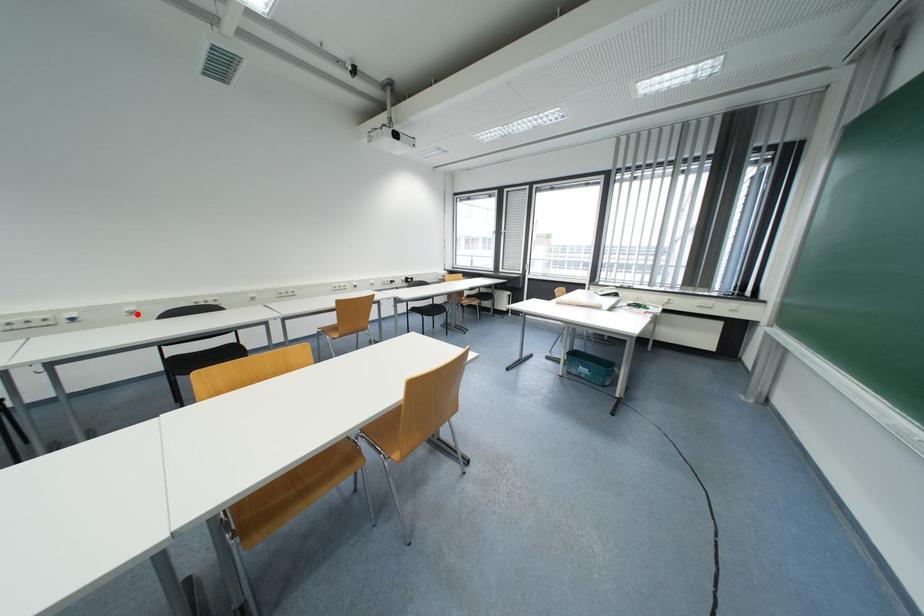
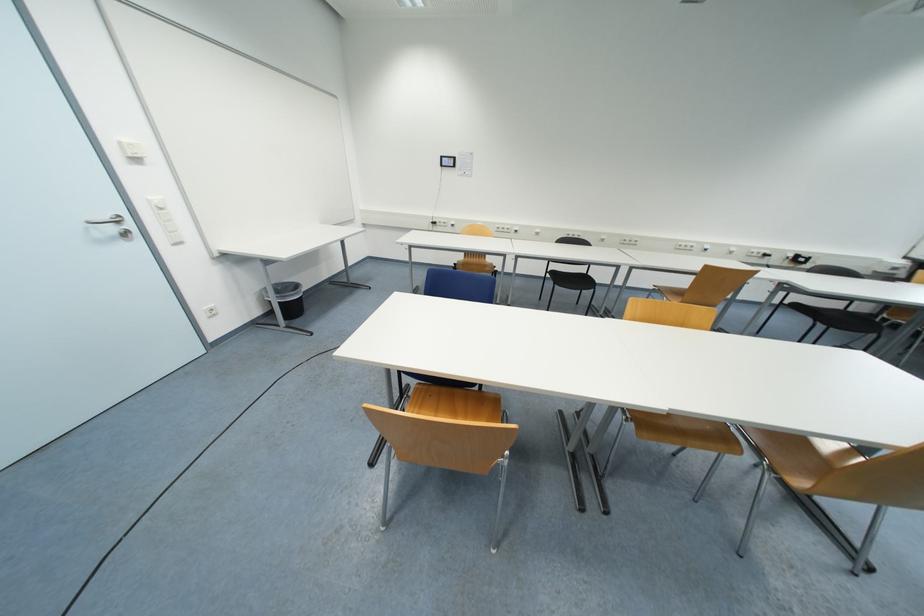
Question: I am providing you with two images of the same scene from different viewpoints. A red point is marked on the first image. Can you still see the location of the red point in image 2?

Choices:
 (A) Yes
 (B) No

Answer: (A)